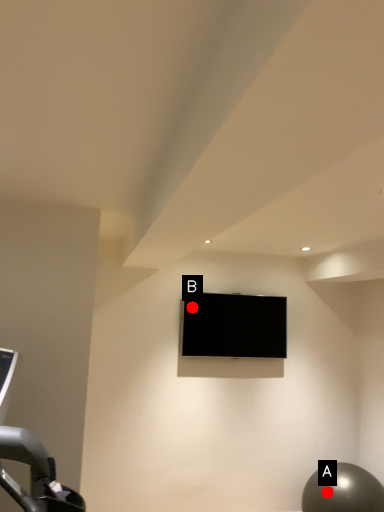
Question: Two points are circled on the image, labeled by A and B beside each circle. Which point appears closest to the camera in this image?

Choices:
 (A) A is closer
 (B) B is closer

Answer: (A)